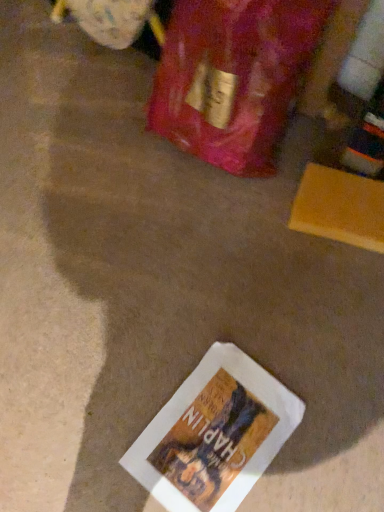
Image resolution: width=384 pixels, height=512 pixels. Describe the element at coordinates (214, 434) in the screenshot. I see `white paper book at lower center` at that location.

I want to click on white paper book at lower center, so click(x=214, y=434).

What is the approximate height of white paper book at lower center?

white paper book at lower center is 0.50 inches in height.

Describe the element at coordinates (367, 139) in the screenshot. I see `clear glass wine bottle at upper right` at that location.

I want to click on clear glass wine bottle at upper right, so click(x=367, y=139).

This screenshot has width=384, height=512. What are the coordinates of `white paper book at lower center` in the screenshot? It's located at (214, 434).

Which object is positioned more to the right, clear glass wine bottle at upper right or white paper book at lower center?

From the viewer's perspective, clear glass wine bottle at upper right appears more on the right side.

Is the position of clear glass wine bottle at upper right less distant than that of white paper book at lower center?

Yes, clear glass wine bottle at upper right is closer to the viewer.

Does point (379, 92) appear closer or farther from the camera than point (251, 395)?

Clearly, point (379, 92) is more distant from the camera than point (251, 395).

In the scene shown: From the image's perspective, which object appears higher, clear glass wine bottle at upper right or white paper book at lower center?

clear glass wine bottle at upper right.

From a real-world perspective, who is located lower, clear glass wine bottle at upper right or white paper book at lower center?

white paper book at lower center.

In terms of width, does clear glass wine bottle at upper right look wider or thinner when compared to white paper book at lower center?

In the image, clear glass wine bottle at upper right appears to be more narrow than white paper book at lower center.

Is clear glass wine bottle at upper right taller than white paper book at lower center?

Yes.

Is clear glass wine bottle at upper right bigger or smaller than white paper book at lower center?

In the image, clear glass wine bottle at upper right appears to be larger than white paper book at lower center.

Consider the image. Would you say white paper book at lower center is part of clear glass wine bottle at upper right's contents?

No, white paper book at lower center is not a part of clear glass wine bottle at upper right.

Is clear glass wine bottle at upper right next to white paper book at lower center?

clear glass wine bottle at upper right and white paper book at lower center are not in contact.

Is clear glass wine bottle at upper right oriented towards white paper book at lower center?

Yes, clear glass wine bottle at upper right is facing white paper book at lower center.

How many degrees apart are the facing directions of clear glass wine bottle at upper right and white paper book at lower center?

3.75 degrees separate the facing orientations of clear glass wine bottle at upper right and white paper book at lower center.

Locate an element on the screen. Image resolution: width=384 pixels, height=512 pixels. wine bottle located on the right of white paper book at lower center is located at coordinates (367, 139).

Can you confirm if white paper book at lower center is positioned to the left of clear glass wine bottle at upper right?

Yes.

Looking at this image, is the position of white paper book at lower center less distant than that of clear glass wine bottle at upper right?

No.

Does point (266, 460) appear closer or farther from the camera than point (350, 150)?

Point (266, 460).

From the image's perspective, is white paper book at lower center positioned above or below clear glass wine bottle at upper right?

white paper book at lower center is below clear glass wine bottle at upper right.

From a real-world perspective, who is located lower, white paper book at lower center or clear glass wine bottle at upper right?

white paper book at lower center is physically lower.

Which object is wider, white paper book at lower center or clear glass wine bottle at upper right?

With larger width is white paper book at lower center.

Which of these two, white paper book at lower center or clear glass wine bottle at upper right, stands shorter?

With less height is white paper book at lower center.

In the scene shown: Considering the sizes of objects white paper book at lower center and clear glass wine bottle at upper right in the image provided, who is smaller, white paper book at lower center or clear glass wine bottle at upper right?

white paper book at lower center.

Which is correct: white paper book at lower center is inside clear glass wine bottle at upper right, or outside of it?

white paper book at lower center cannot be found inside clear glass wine bottle at upper right.

Is the surface of white paper book at lower center in direct contact with clear glass wine bottle at upper right?

No, white paper book at lower center is not touching clear glass wine bottle at upper right.

Could you tell me if white paper book at lower center is facing clear glass wine bottle at upper right?

No.

What's the angular difference between white paper book at lower center and clear glass wine bottle at upper right's facing directions?

The angular difference between white paper book at lower center and clear glass wine bottle at upper right is 3.75 degrees.

Identify the location of wine bottle located above the white paper book at lower center (from the image's perspective). (367, 139).

Locate an element on the screen. The height and width of the screenshot is (512, 384). wine bottle in front of the white paper book at lower center is located at coordinates (367, 139).

At what (x,y) coordinates should I click in order to perform the action: click on wine bottle that appears above the white paper book at lower center (from the image's perspective). Please return your answer as a coordinate pair (x, y). Image resolution: width=384 pixels, height=512 pixels. Looking at the image, I should click on (367, 139).